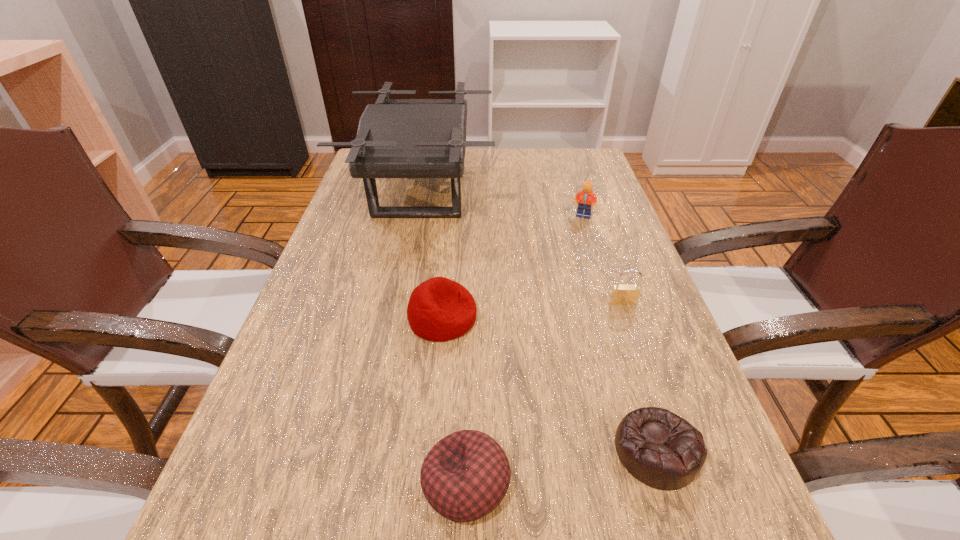
This screenshot has height=540, width=960. Identify the location of drone. (397, 138).

At what (x,y) coordinates should I click in order to perform the action: click on Lego. Please return your answer as a coordinate pair (x, y). Image resolution: width=960 pixels, height=540 pixels. Looking at the image, I should click on (585, 198).

At what (x,y) coordinates should I click in order to perform the action: click on padlock. Please return your answer as a coordinate pair (x, y). This screenshot has height=540, width=960. Looking at the image, I should click on (625, 294).

Locate an element on the screen. The width and height of the screenshot is (960, 540). the farthest beanbag is located at coordinates (439, 309).

Identify the location of the shortest object. point(662,450).

Image resolution: width=960 pixels, height=540 pixels. Identify the location of the shortest beanbag. (662, 450).

What are the coordinates of `vacant space situated 0.330m with a camera mounted on the underside of the drone` in the screenshot? It's located at (609, 190).

The height and width of the screenshot is (540, 960). Find the location of `free space located on the front-facing side of the Lego`. free space located on the front-facing side of the Lego is located at coordinates (588, 231).

I want to click on free space located on the front-facing side of the padlock, so click(675, 450).

This screenshot has height=540, width=960. Find the location of `vacant area situated on the seat area of the farthest beanbag`. vacant area situated on the seat area of the farthest beanbag is located at coordinates (609, 318).